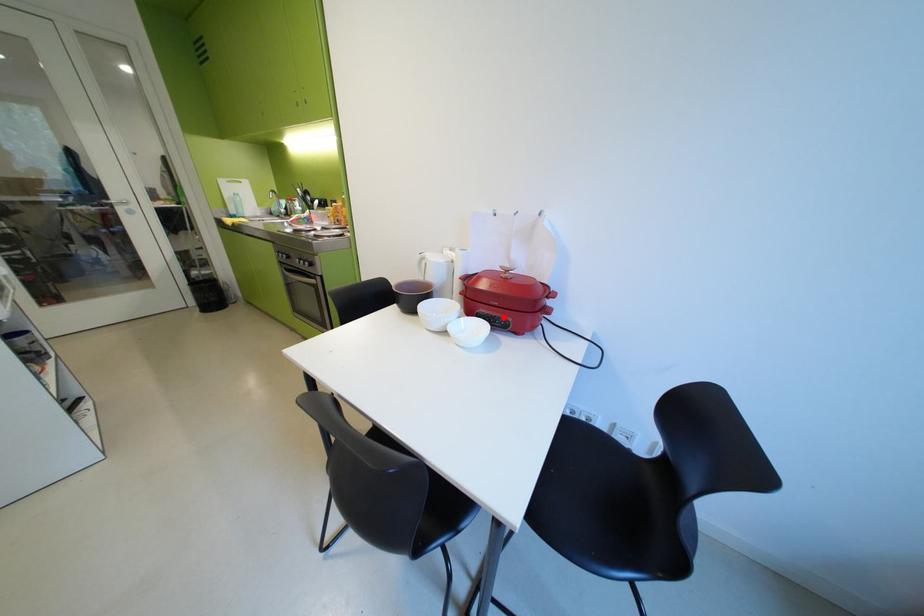
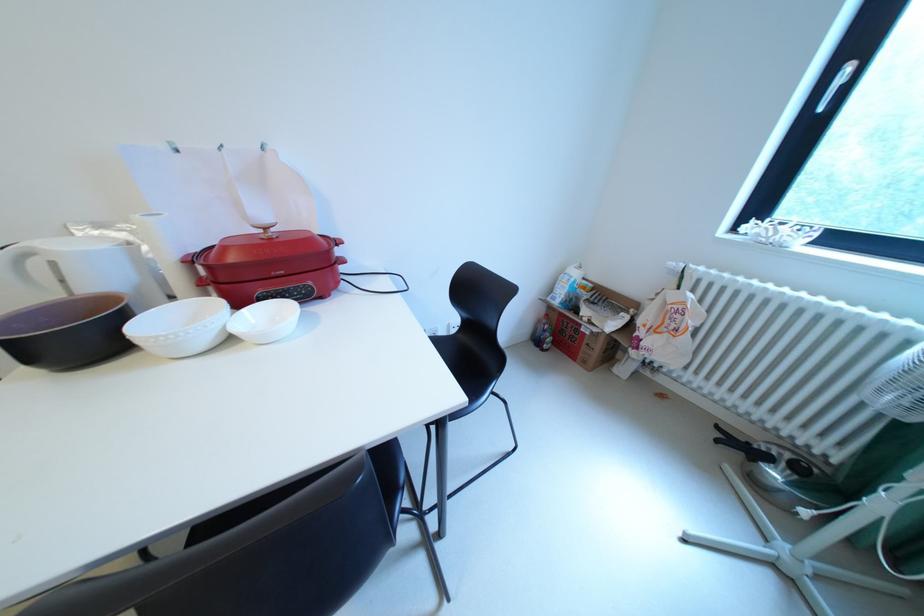
In the second image, find the point that corresponds to the highlighted location in the first image.

(295, 292)